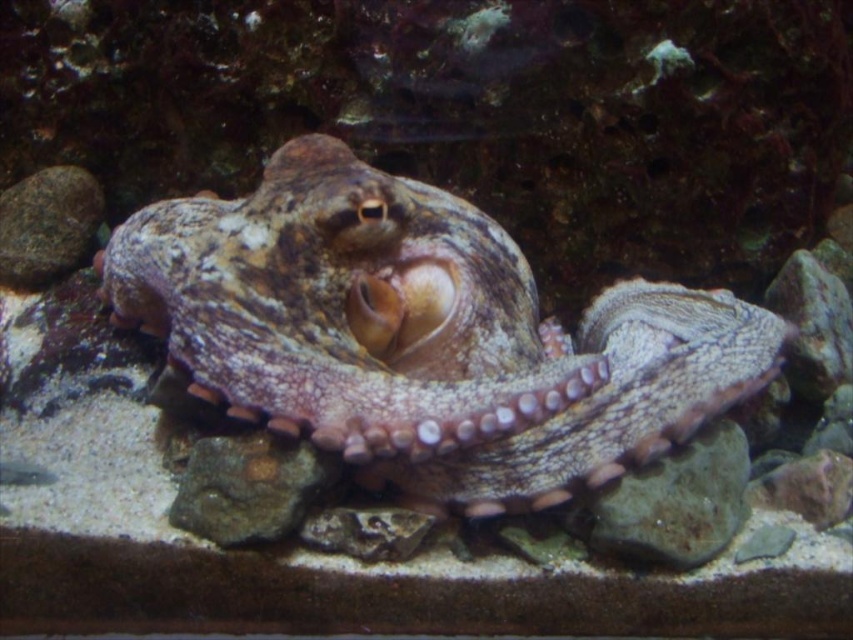
Question: Can you confirm if camouflage skin octopus at center is positioned to the right of gray rock at upper left?

Choices:
 (A) yes
 (B) no

Answer: (A)

Question: In this image, where is camouflage skin octopus at center located relative to gray rock at upper left?

Choices:
 (A) right
 (B) left

Answer: (A)

Question: Among these objects, which one is nearest to the camera?

Choices:
 (A) green mossy rock at center
 (B) camouflage skin octopus at center
 (C) gray rock at upper left
 (D) smooth gray rock at lower right

Answer: (B)

Question: Which is farther from the gray rock at upper left?

Choices:
 (A) green mossy rock at center
 (B) smooth gray rock at lower right

Answer: (B)

Question: Which of these objects is positioned closest to the smooth gray rock at lower right?

Choices:
 (A) gray rock at upper left
 (B) camouflage skin octopus at center

Answer: (B)

Question: Is smooth gray rock at lower right to the right of gray rock at upper left from the viewer's perspective?

Choices:
 (A) no
 (B) yes

Answer: (B)